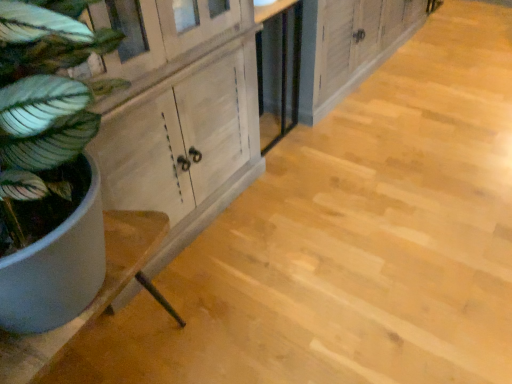
Locate an element on the screen. vacant space to the right of white wood counter at left is located at coordinates (265, 332).